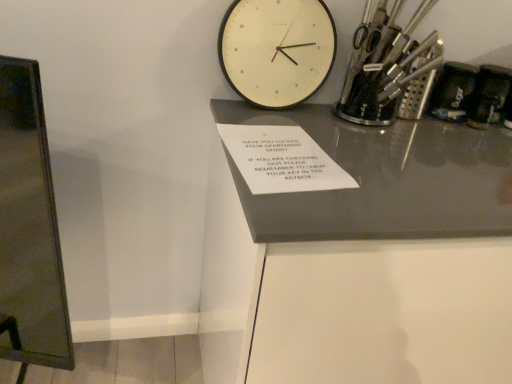
Where is `unoccupied region to the right of white matte wall clock at upper center`? The image size is (512, 384). unoccupied region to the right of white matte wall clock at upper center is located at coordinates (334, 130).